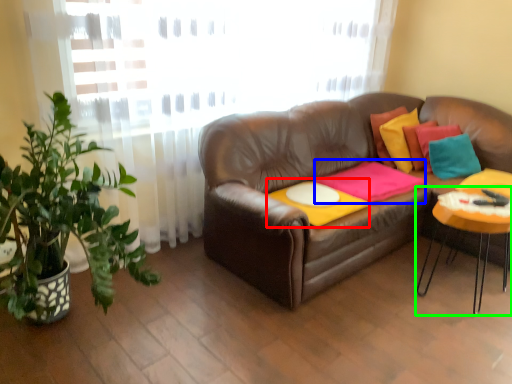
Question: Considering the real-world distances, which object is farthest from round table (highlighted by a red box)? blanket (highlighted by a blue box) or table (highlighted by a green box)?

Choices:
 (A) blanket
 (B) table

Answer: (B)